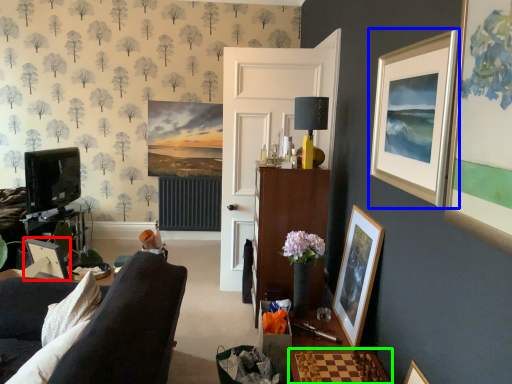
Question: Which object is the farthest from picture frame (highlighted by a red box)? Choose among these: picture frame (highlighted by a blue box) or table (highlighted by a green box).

Choices:
 (A) picture frame
 (B) table

Answer: (A)